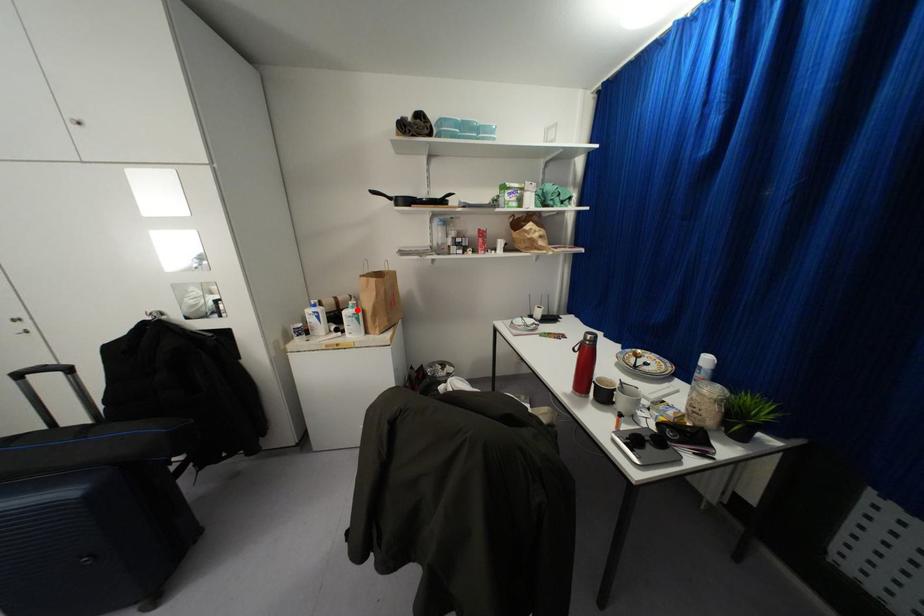
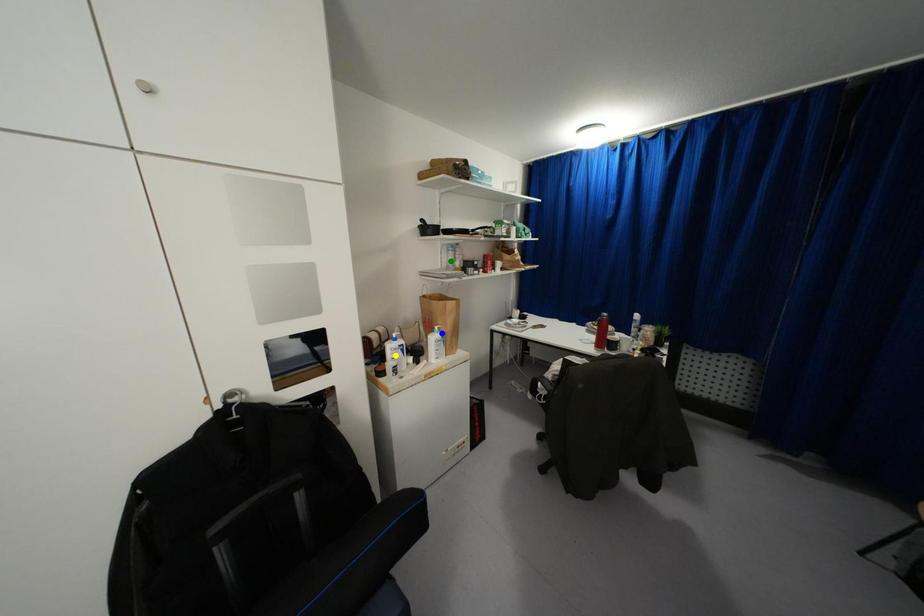
Question: I am providing you with two images of the same scene from different viewpoints. A red point is marked on the first image. You are given multiple points on the second image. In image 2, which mark is for the same physical point as the one in image 1?

Choices:
 (A) yellow point
 (B) green point
 (C) blue point

Answer: (C)